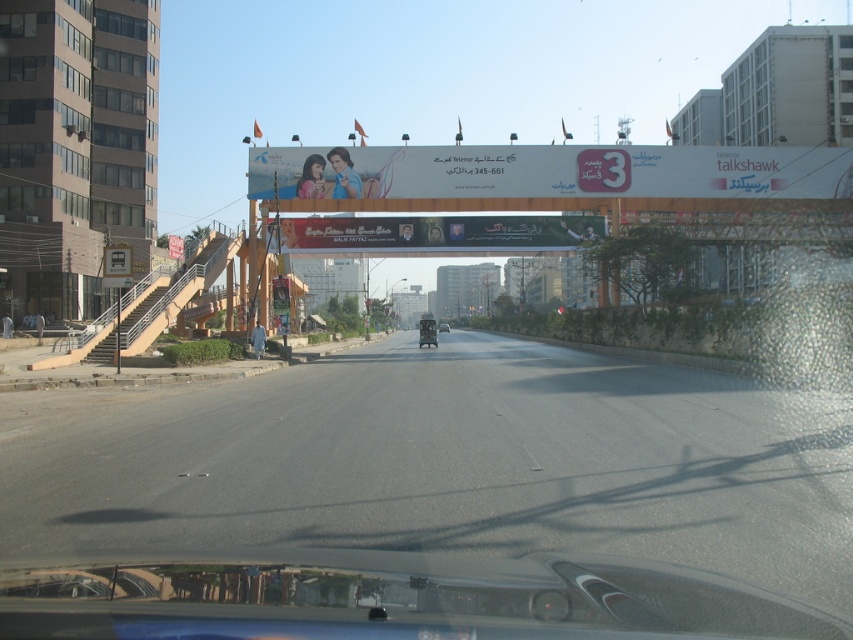
In the scene shown: You are driving a metallic silver car at center and want to see the billboard above the road. Since the transparent glass windshield at center is blocking your view, can you lower the windshield to get a better look?

The transparent glass windshield at center is in front of the metallic silver car at center, so you cannot lower the windshield as it is a fixed part of the car. Consider using the side mirrors or adjusting your seating position to view the billboard above the road.

You are driving a car and want to ensure you stay on the asphalt road at center. Given that the transparent glass windshield at center is in your direct line of sight, which object would you use to navigate and keep your vehicle on the correct path?

The asphalt road at center has a larger size compared to the transparent glass windshield at center, so you should focus on following the asphalt road at center to stay on the correct path.